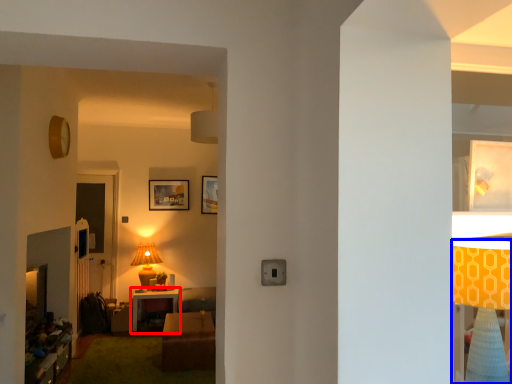
Question: Which object is closer to the camera taking this photo, table (highlighted by a red box) or lamp (highlighted by a blue box)?

Choices:
 (A) table
 (B) lamp

Answer: (B)